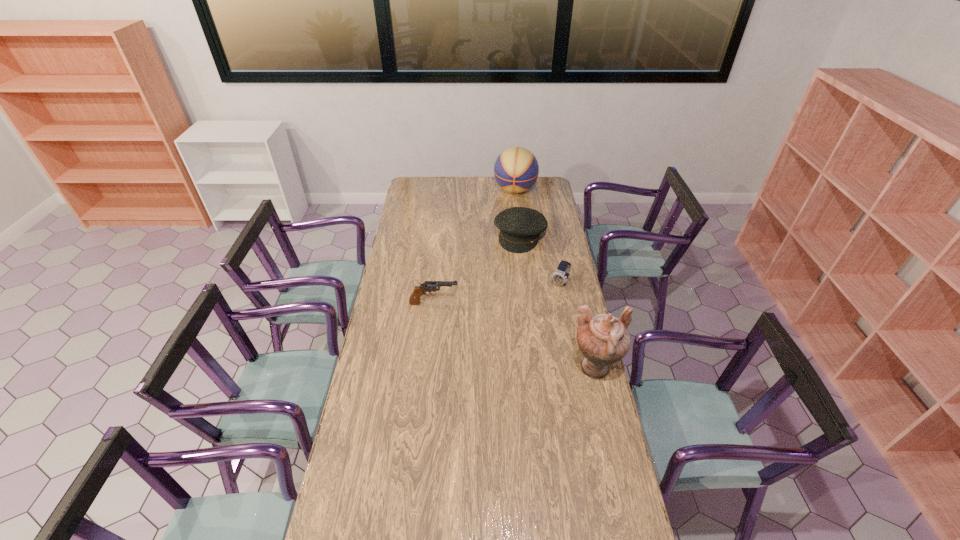
Where is `vacant region located 0.170m on the front-facing side of the beret`? vacant region located 0.170m on the front-facing side of the beret is located at coordinates (507, 273).

Where is `vacant space located 0.380m on the face of the third farthest object`? This screenshot has height=540, width=960. vacant space located 0.380m on the face of the third farthest object is located at coordinates (520, 343).

The height and width of the screenshot is (540, 960). I want to click on vacant space located 0.140m on the face of the third farthest object, so (x=544, y=308).

The image size is (960, 540). Find the location of `vacant space positioned on the face of the third farthest object`. vacant space positioned on the face of the third farthest object is located at coordinates (520, 343).

This screenshot has height=540, width=960. I want to click on blank space located on the patterned surface of the basketball, so click(509, 222).

At what (x,y) coordinates should I click in order to perform the action: click on vacant space located on the patterned surface of the basketball. Please return your answer as a coordinate pair (x, y). Image resolution: width=960 pixels, height=540 pixels. Looking at the image, I should click on (505, 241).

Find the location of a particular element. This screenshot has height=540, width=960. free spot located 0.320m on the patterned surface of the basketball is located at coordinates (507, 233).

I want to click on object at the far edge, so click(516, 169).

Image resolution: width=960 pixels, height=540 pixels. Find the location of `object situated at the left edge`. object situated at the left edge is located at coordinates (428, 286).

Where is `urn at the right edge`? The width and height of the screenshot is (960, 540). urn at the right edge is located at coordinates (604, 339).